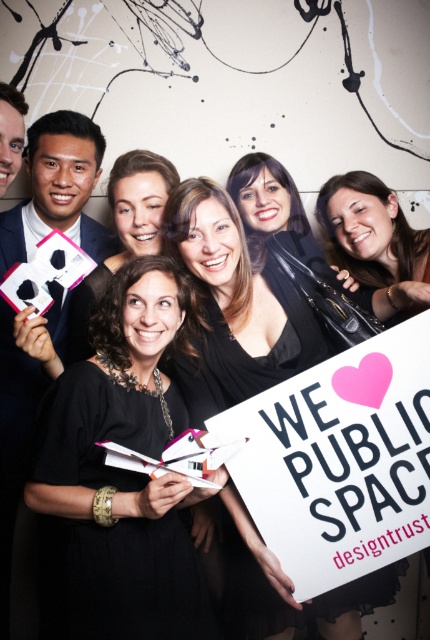
Question: Is white paper sign at center bigger than matte black hair at center?

Choices:
 (A) no
 (B) yes

Answer: (A)

Question: Which object appears farthest from the camera in this image?

Choices:
 (A) black matte dress at center
 (B) black matte sign at center

Answer: (B)

Question: Does white paper sign at center come in front of black matte sign at center?

Choices:
 (A) no
 (B) yes

Answer: (B)

Question: Among these objects, which one is nearest to the camera?

Choices:
 (A) white paper sign at center
 (B) black matte sign at center
 (C) black matte dress at center
 (D) matte black hair at center

Answer: (C)

Question: Can you confirm if black matte dress at center is positioned above matte black hair at center?

Choices:
 (A) no
 (B) yes

Answer: (A)

Question: Which object appears closest to the camera in this image?

Choices:
 (A) black matte sign at center
 (B) white paper sign at center

Answer: (B)